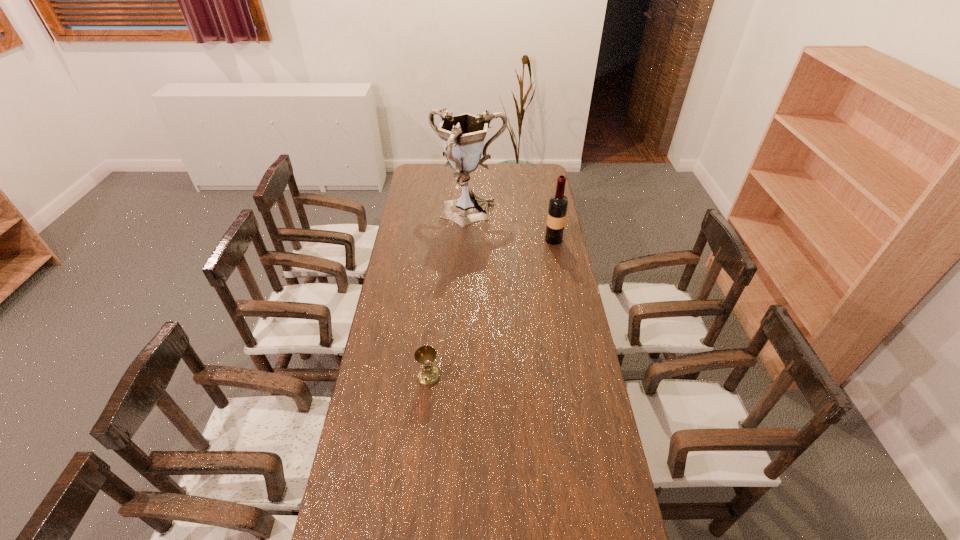
Identify the location of vacant space that satisfies the following two spatial constraints: 1. on the back side of the shortest object; 2. on the left side of the tallest object. (444, 214).